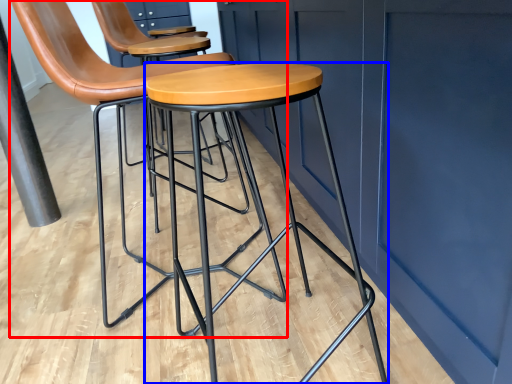
Question: Among these objects, which one is farthest to the camera, chair (highlighted by a red box) or stool (highlighted by a blue box)?

Choices:
 (A) chair
 (B) stool

Answer: (A)